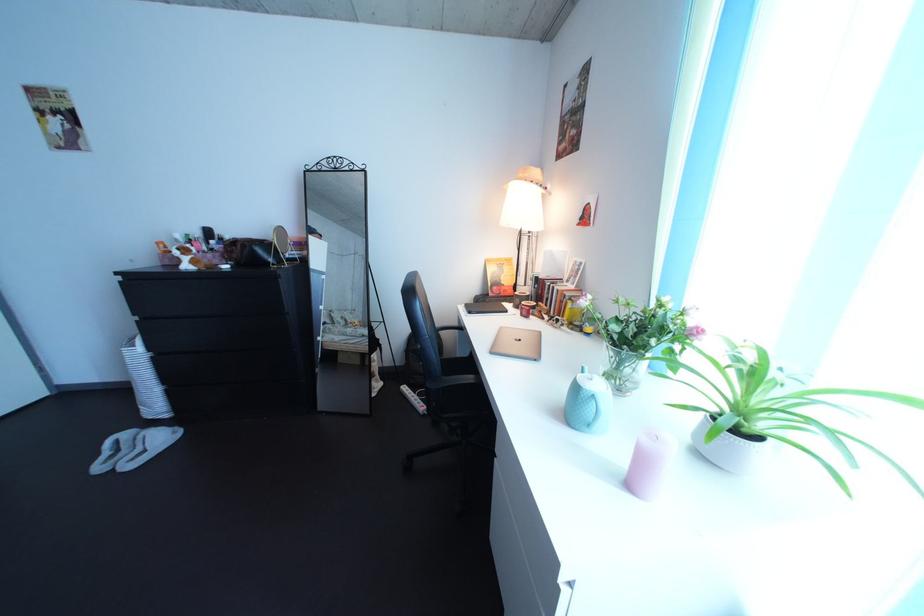
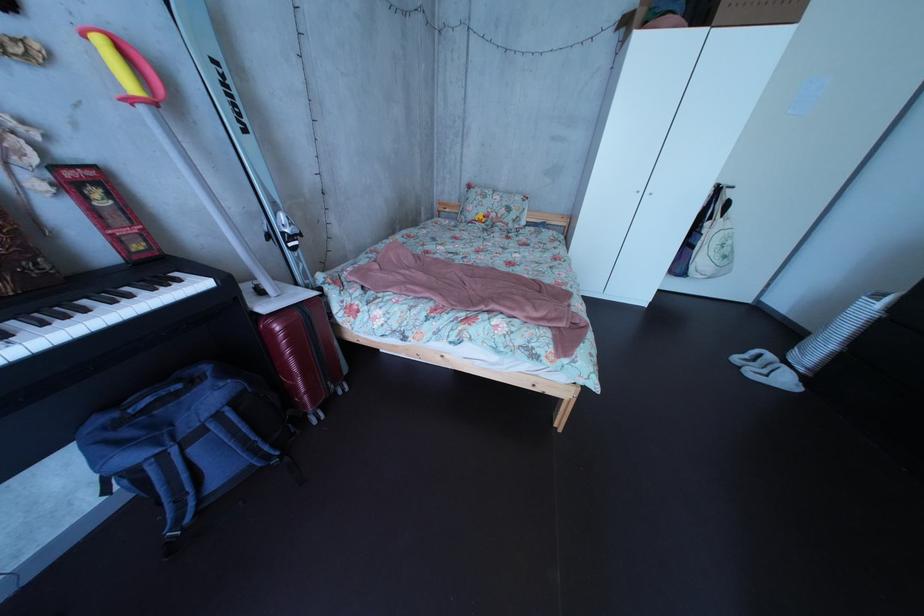
Find the pixel in the second image that matches [140,443] in the first image.

(784, 363)